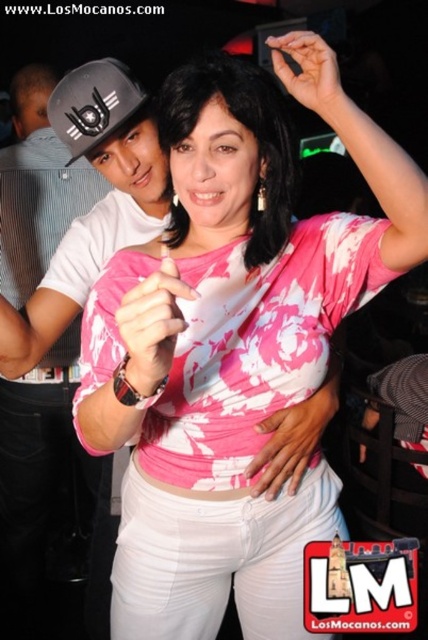
Does matte white t-shirt at upper left come in front of matte black baseball cap at upper left?

No, it is not.

Between point (38, 154) and point (101, 124), which one is positioned behind?

Positioned behind is point (38, 154).

Where is `matte white t-shirt at upper left`? This screenshot has height=640, width=428. matte white t-shirt at upper left is located at coordinates tap(65, 305).